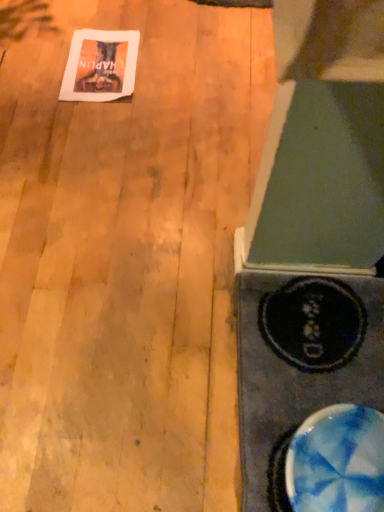
I want to click on free space behind white paper at upper left, so click(x=105, y=20).